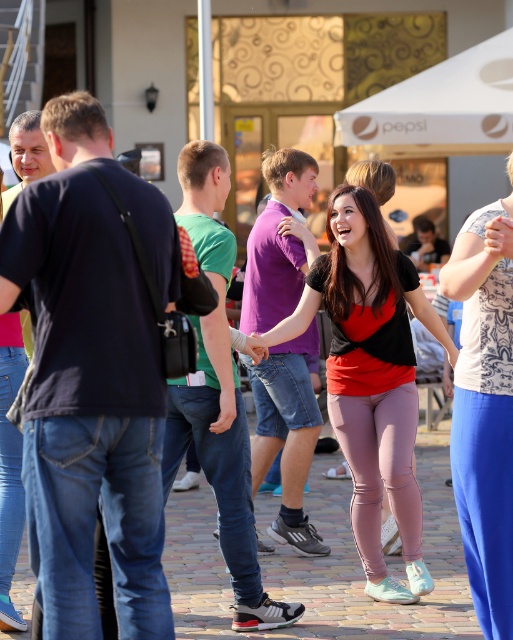
Question: Is matte black top at center positioned at the back of printed cotton blouse at right?

Choices:
 (A) yes
 (B) no

Answer: (A)

Question: Does matte black top at center lie in front of printed cotton blouse at right?

Choices:
 (A) yes
 (B) no

Answer: (B)

Question: Is matte black top at center wider than printed cotton blouse at right?

Choices:
 (A) no
 (B) yes

Answer: (B)

Question: Which point appears farthest from the camera in this image?

Choices:
 (A) (499, 500)
 (B) (339, 372)

Answer: (B)

Question: Which point appears farthest from the camera in this image?

Choices:
 (A) 403,390
 (B) 487,534

Answer: (A)